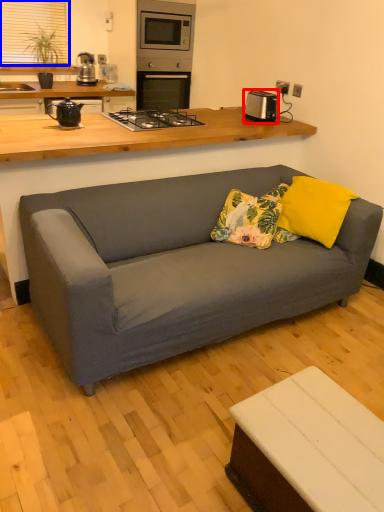
Question: Which object is closer to the camera taking this photo, appliance (highlighted by a red box) or window screen (highlighted by a blue box)?

Choices:
 (A) appliance
 (B) window screen

Answer: (A)